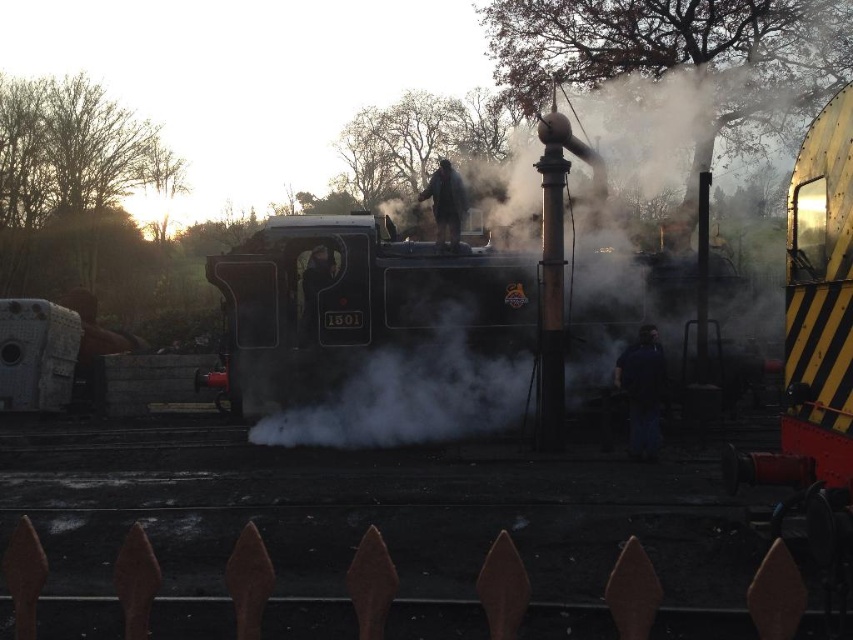
Based on the photo, measure the distance between point [651,401] and camera.

A distance of 38.26 feet exists between point [651,401] and camera.

Who is taller, dark blue fabric at center or dark fabric jacket at center?

Standing taller between the two is dark blue fabric at center.

What are the coordinates of `dark blue fabric at center` in the screenshot? It's located at (642, 390).

Does dark blue fabric at center appear on the left side of dark gray fabric jacket at center?

No, dark blue fabric at center is not to the left of dark gray fabric jacket at center.

Between point (647, 362) and point (450, 177), which one is positioned in front?

Point (647, 362)

Where is `dark blue fabric at center`? Image resolution: width=853 pixels, height=640 pixels. dark blue fabric at center is located at coordinates (642, 390).

Does dark gray fabric jacket at center appear on the right side of dark fabric jacket at center?

Indeed, dark gray fabric jacket at center is positioned on the right side of dark fabric jacket at center.

Is the position of dark gray fabric jacket at center less distant than that of dark fabric jacket at center?

That is False.

The height and width of the screenshot is (640, 853). In order to click on dark gray fabric jacket at center in this screenshot , I will do click(x=445, y=204).